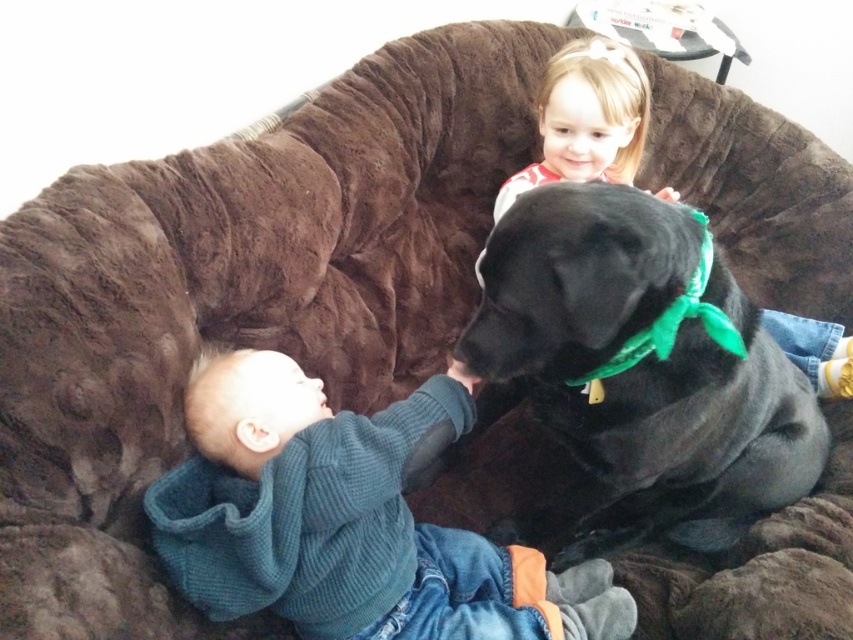
Question: Which object appears closest to the camera in this image?

Choices:
 (A) blonde hair at upper right
 (B) knitted teal sweater at lower left

Answer: (B)

Question: Which object appears closest to the camera in this image?

Choices:
 (A) black matte dog at center
 (B) blonde hair at upper right

Answer: (A)

Question: Considering the relative positions of black matte dog at center and blonde hair at upper right in the image provided, where is black matte dog at center located with respect to blonde hair at upper right?

Choices:
 (A) below
 (B) above

Answer: (A)

Question: Does black matte dog at center come in front of knitted teal sweater at lower left?

Choices:
 (A) yes
 (B) no

Answer: (A)

Question: Is the position of black matte dog at center less distant than that of blonde hair at upper right?

Choices:
 (A) yes
 (B) no

Answer: (A)

Question: Which point is closer to the camera?

Choices:
 (A) black matte dog at center
 (B) knitted teal sweater at lower left
 (C) blonde hair at upper right

Answer: (A)